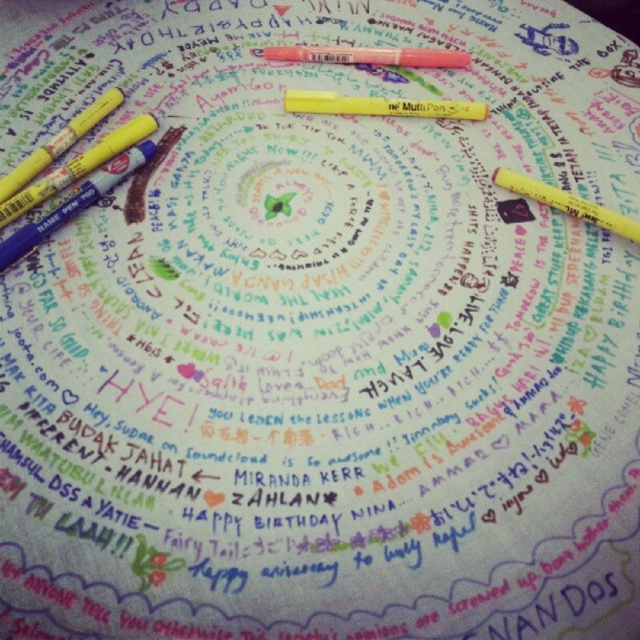
Question: Considering the real-world distances, which object is closest to the yellow matte marker at upper left?

Choices:
 (A) yellow matte pen at center
 (B) yellow matte marker at upper right

Answer: (A)

Question: Which of these objects is positioned farthest from the yellow matte pen at center?

Choices:
 (A) matte pink crayon at center
 (B) yellow matte marker at upper right

Answer: (B)

Question: Is yellow matte pen at center to the left of yellow matte marker at upper left from the viewer's perspective?

Choices:
 (A) no
 (B) yes

Answer: (A)

Question: Is yellow matte pen at center wider than yellow matte marker at upper right?

Choices:
 (A) no
 (B) yes

Answer: (B)

Question: Which of these objects is positioned farthest from the matte pink crayon at center?

Choices:
 (A) yellow matte pen at center
 (B) yellow matte marker at upper left
 (C) yellow matte marker at upper right

Answer: (B)

Question: Is yellow matte pen at center wider than yellow matte marker at upper left?

Choices:
 (A) yes
 (B) no

Answer: (A)